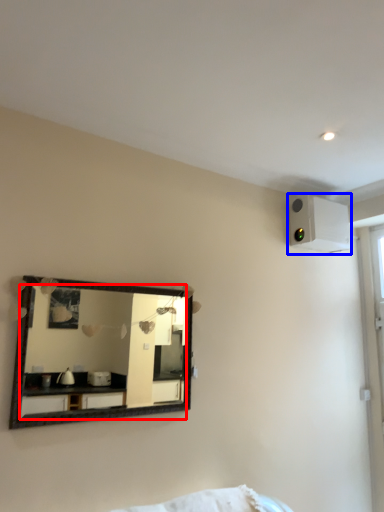
Question: Which object is further to the camera taking this photo, mirror (highlighted by a red box) or air conditioning (highlighted by a blue box)?

Choices:
 (A) mirror
 (B) air conditioning

Answer: (B)